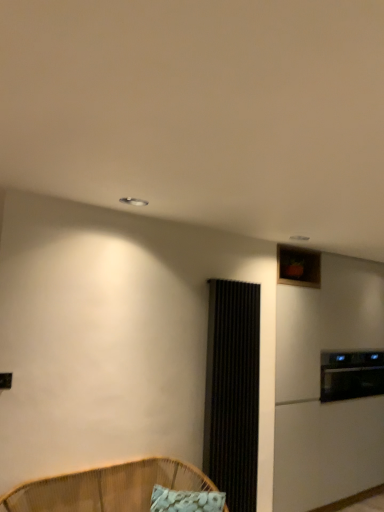
Question: From the image's perspective, is black glass oven at right located above or below white fabric pillow at lower center?

Choices:
 (A) above
 (B) below

Answer: (A)

Question: Would you say black glass oven at right is inside or outside white fabric pillow at lower center?

Choices:
 (A) outside
 (B) inside

Answer: (A)

Question: Considering the real-world distances, which object is farthest from the white fabric pillow at lower center?

Choices:
 (A) black glass oven at right
 (B) woven bamboo chair at lower left
 (C) black textured screen door at center-right

Answer: (A)

Question: Based on their relative distances, which object is farther from the woven bamboo chair at lower left?

Choices:
 (A) black textured screen door at center-right
 (B) white fabric pillow at lower center
 (C) black glass oven at right

Answer: (C)